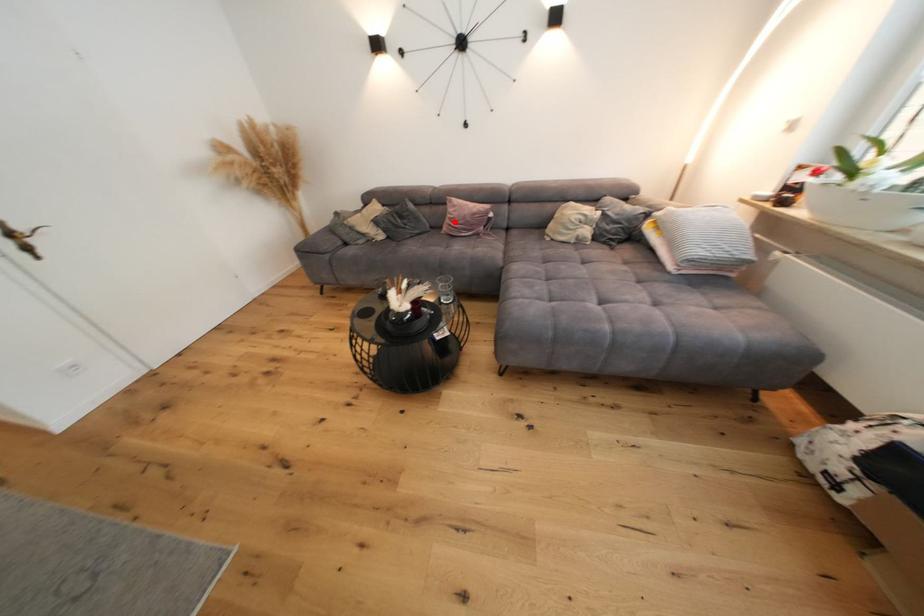
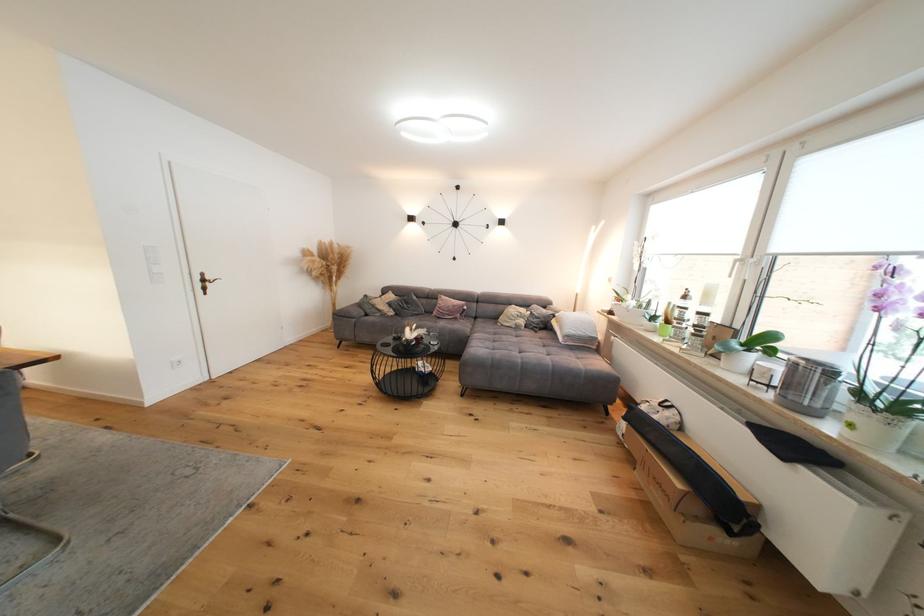
Where in the second image is the point corresponding to the highlighted location from the first image?

(444, 310)